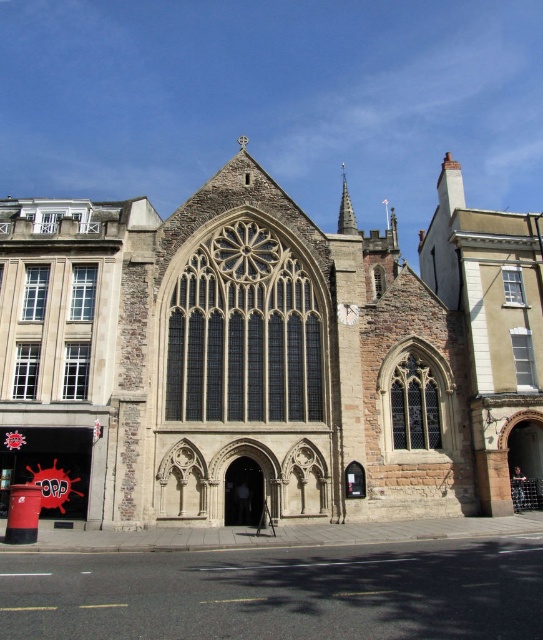
Question: Which point appears farthest from the camera in this image?

Choices:
 (A) (353, 320)
 (B) (345, 184)
 (C) (181, 516)

Answer: (B)

Question: Estimate the real-world distances between objects in this image. Which object is farther from the beige stone church at center?

Choices:
 (A) smooth stone spire at upper center
 (B) white stone clock at center

Answer: (A)

Question: Considering the relative positions of beige stone church at center and white stone clock at center in the image provided, where is beige stone church at center located with respect to white stone clock at center?

Choices:
 (A) below
 (B) above

Answer: (B)

Question: Can you confirm if beige stone church at center is positioned to the left of smooth stone spire at upper center?

Choices:
 (A) yes
 (B) no

Answer: (A)

Question: Does beige stone church at center lie in front of white stone clock at center?

Choices:
 (A) yes
 (B) no

Answer: (A)

Question: Which point is closer to the camera taking this photo?

Choices:
 (A) (337, 278)
 (B) (344, 220)

Answer: (A)